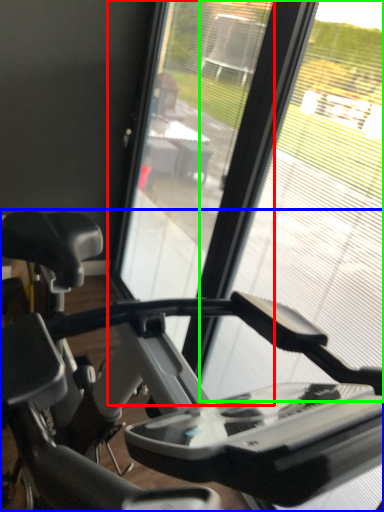
Question: Estimate the real-world distances between objects in this image. Which object is closer to screen door (highlighted by a red box), stationary bicycle (highlighted by a blue box) or glass window (highlighted by a green box)?

Choices:
 (A) stationary bicycle
 (B) glass window

Answer: (B)